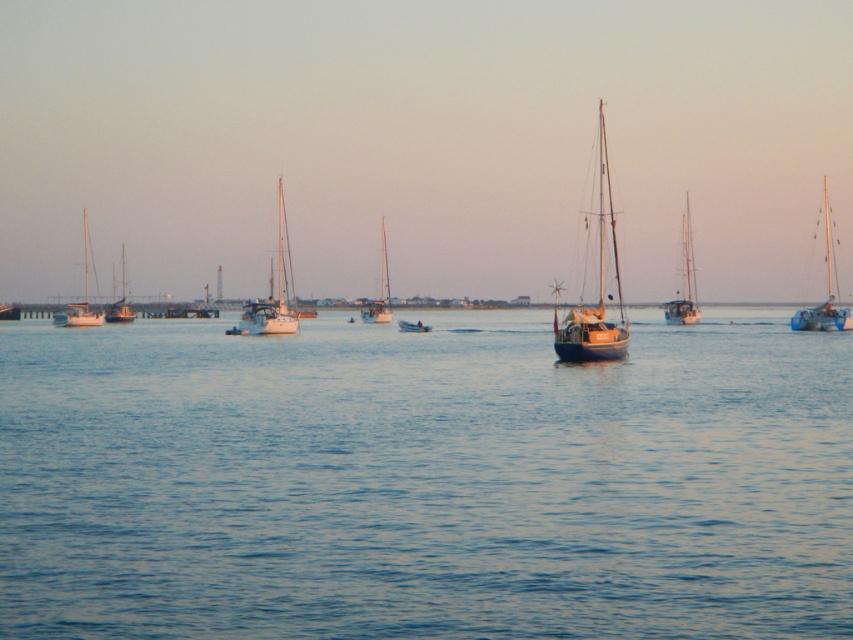
Does blue water at center come in front of blue matte sailboat at center?

Yes, it is.

Between blue water at center and blue matte sailboat at center, which one is positioned lower?

blue water at center is below.

What are the coordinates of `blue water at center` in the screenshot? It's located at (424, 481).

Is the position of matte white sailboat at left less distant than that of metallic blue dinghy at center?

No, matte white sailboat at left is further to the viewer.

Looking at this image, which is more to the left, matte white sailboat at left or metallic blue dinghy at center?

matte white sailboat at left

Who is more forward, (107, 321) or (405, 323)?

Point (405, 323) is in front.

Identify the location of matte white sailboat at left. (120, 301).

Who is shorter, blue water at center or white matte sailboat at left?

Standing shorter between the two is blue water at center.

Does blue water at center appear over white matte sailboat at left?

No, blue water at center is not above white matte sailboat at left.

Is point (421, 412) positioned behind point (73, 321)?

No.

This screenshot has height=640, width=853. Identify the location of blue water at center. (424, 481).